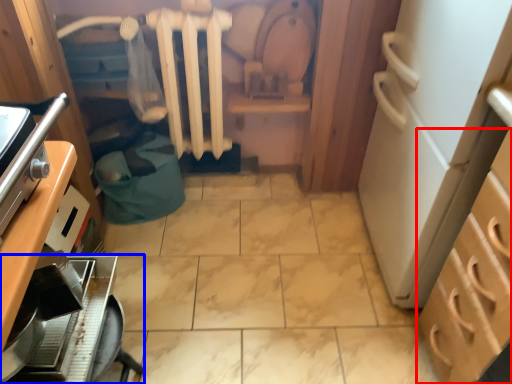
Question: Which point is further to the camera, cabinetry (highlighted by a red box) or kitchen appliance (highlighted by a blue box)?

Choices:
 (A) cabinetry
 (B) kitchen appliance

Answer: (B)